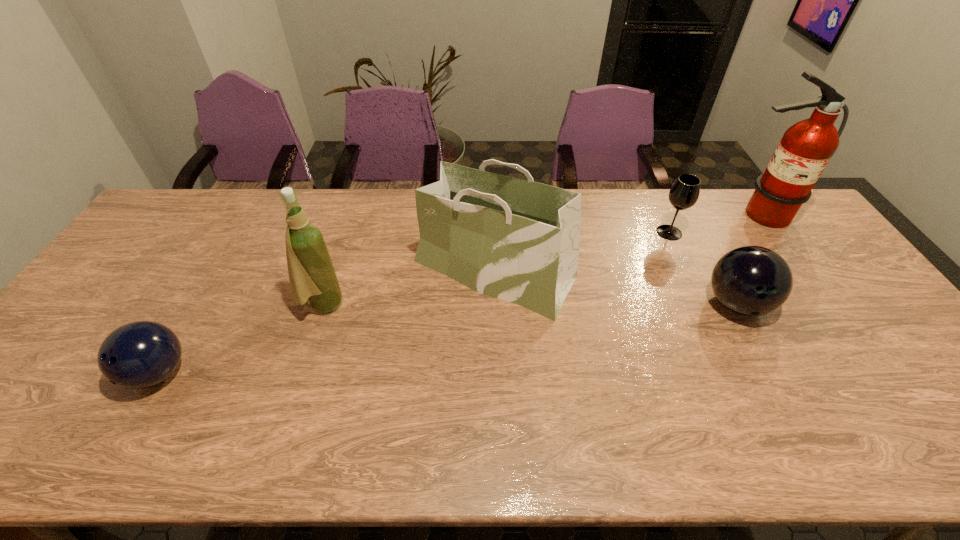
Locate an element on the screen. The width and height of the screenshot is (960, 540). the rightmost object is located at coordinates (805, 149).

I want to click on the tallest object, so click(x=805, y=149).

The image size is (960, 540). Identify the location of the second object from left to right. (312, 276).

The width and height of the screenshot is (960, 540). I want to click on the third object from left to right, so pyautogui.click(x=517, y=240).

Where is `wineglass`? This screenshot has width=960, height=540. wineglass is located at coordinates (684, 193).

Locate an element on the screen. The width and height of the screenshot is (960, 540). the right bowling ball is located at coordinates [x=750, y=280].

I want to click on the taller bowling ball, so click(x=750, y=280).

Where is `the leftmost object`? The image size is (960, 540). the leftmost object is located at coordinates (137, 355).

In order to click on the left bowling ball in this screenshot , I will do `click(137, 355)`.

I want to click on free region located on the nozzle and handle of the tallest object, so (x=808, y=286).